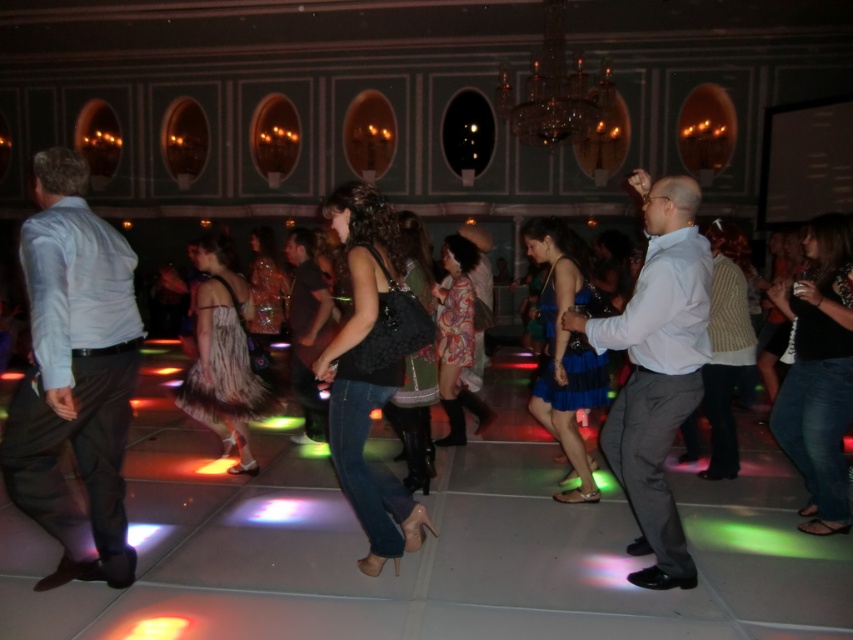
Is light blue shirt at left further to camera compared to dark brown leather jacket at center?

No, it is not.

Image resolution: width=853 pixels, height=640 pixels. What do you see at coordinates (74, 374) in the screenshot?
I see `light blue shirt at left` at bounding box center [74, 374].

Find the location of a particular element. This screenshot has width=853, height=640. light blue shirt at left is located at coordinates (74, 374).

Is light blue shirt at left in front of light gray fabric shirt at center?

Yes.

Does light blue shirt at left have a greater width compared to light gray fabric shirt at center?

In fact, light blue shirt at left might be narrower than light gray fabric shirt at center.

Find the location of a particular element. The height and width of the screenshot is (640, 853). light blue shirt at left is located at coordinates (74, 374).

Does light gray fabric shirt at center have a lesser height compared to dark brown leather jacket at center?

Incorrect, light gray fabric shirt at center's height does not fall short of dark brown leather jacket at center's.

Is the position of light gray fabric shirt at center less distant than that of dark brown leather jacket at center?

That is True.

Is point (647, 218) closer to viewer compared to point (302, 435)?

Yes, point (647, 218) is in front of point (302, 435).

Identify the location of light gray fabric shirt at center. The height and width of the screenshot is (640, 853). (657, 369).